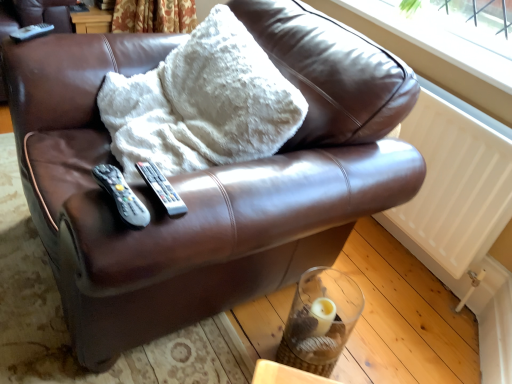
Question: Considering the positions of white plastic window frame at upper right and black plastic remote at center, which ranks as the 2th remote in right-to-left order, in the image, is white plastic window frame at upper right bigger or smaller than black plastic remote at center, which ranks as the 2th remote in right-to-left order,?

Choices:
 (A) big
 (B) small

Answer: (A)

Question: Is point (492, 67) positioned closer to the camera than point (104, 178)?

Choices:
 (A) closer
 (B) farther

Answer: (B)

Question: Which is farther from the white plastic window frame at upper right?

Choices:
 (A) white matte remote at upper left, positioned as the 1th remote in left-to-right order
 (B) white plastic remote at center, the first remote viewed from the right
 (C) black plastic remote at center, the 1th remote when ordered from front to back
 (D) white matte radiator at lower right

Answer: (A)

Question: Which object is the farthest from the white matte radiator at lower right?

Choices:
 (A) white plastic remote at center, the first remote viewed from the right
 (B) white matte remote at upper left, arranged as the first remote when viewed from the back
 (C) black plastic remote at center, the third remote when ordered from top to bottom
 (D) white plastic window frame at upper right

Answer: (B)